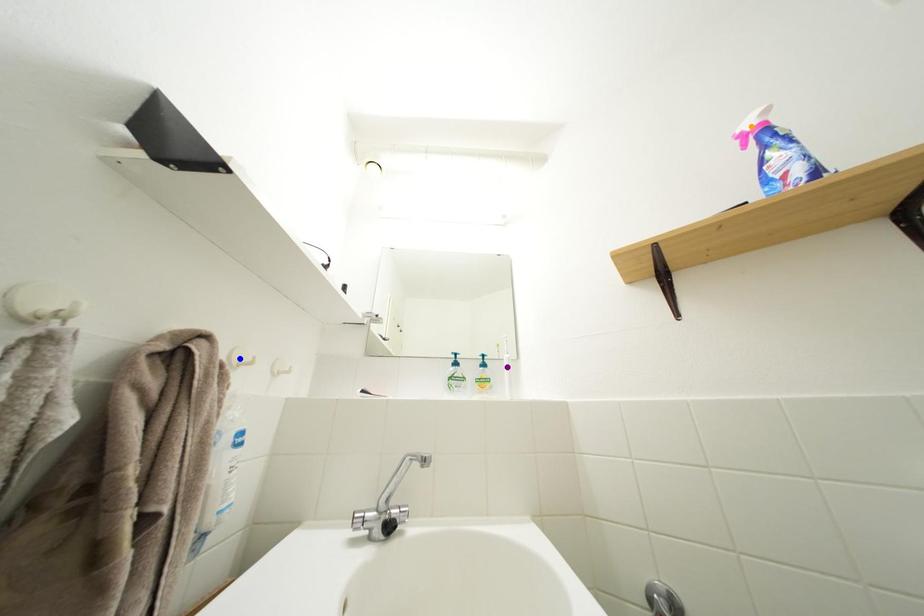
Order these from nearest to farthest:
1. orange point
2. blue point
3. purple point

blue point < orange point < purple point